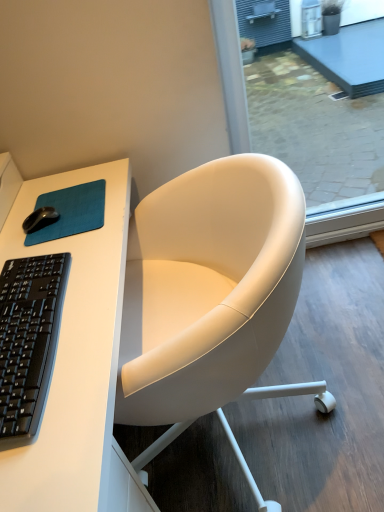
Question: Does transparent glass screen door at upper right contain white leather chair at center?

Choices:
 (A) yes
 (B) no

Answer: (B)

Question: Can we say transparent glass screen door at upper right lies outside white leather chair at center?

Choices:
 (A) no
 (B) yes

Answer: (B)

Question: Does transparent glass screen door at upper right have a lesser height compared to white leather chair at center?

Choices:
 (A) no
 (B) yes

Answer: (A)

Question: Is transparent glass screen door at upper right to the right of white leather chair at center from the viewer's perspective?

Choices:
 (A) yes
 (B) no

Answer: (A)

Question: Are transparent glass screen door at upper right and white leather chair at center located far from each other?

Choices:
 (A) yes
 (B) no

Answer: (B)

Question: From their relative heights in the image, would you say white leather chair at center is taller or shorter than teal fabric mousepad at upper left?

Choices:
 (A) tall
 (B) short

Answer: (A)

Question: From a real-world perspective, relative to teal fabric mousepad at upper left, is white leather chair at center vertically above or below?

Choices:
 (A) above
 (B) below

Answer: (B)

Question: In the image, is white leather chair at center positioned in front of or behind teal fabric mousepad at upper left?

Choices:
 (A) behind
 (B) front

Answer: (A)

Question: From the image's perspective, is white leather chair at center positioned above or below teal fabric mousepad at upper left?

Choices:
 (A) above
 (B) below

Answer: (B)

Question: Considering the positions of transparent glass screen door at upper right and white matte desk at upper left in the image, is transparent glass screen door at upper right taller or shorter than white matte desk at upper left?

Choices:
 (A) short
 (B) tall

Answer: (B)

Question: Would you say transparent glass screen door at upper right is inside or outside white matte desk at upper left?

Choices:
 (A) outside
 (B) inside

Answer: (A)

Question: Is point (236, 54) positioned closer to the camera than point (100, 411)?

Choices:
 (A) farther
 (B) closer

Answer: (A)

Question: Considering the positions of transparent glass screen door at upper right and white matte desk at upper left in the image, is transparent glass screen door at upper right wider or thinner than white matte desk at upper left?

Choices:
 (A) wide
 (B) thin

Answer: (B)

Question: From the image's perspective, is transparent glass screen door at upper right positioned above or below white leather chair at center?

Choices:
 (A) below
 (B) above

Answer: (B)

Question: Considering the positions of transparent glass screen door at upper right and white leather chair at center in the image, is transparent glass screen door at upper right wider or thinner than white leather chair at center?

Choices:
 (A) wide
 (B) thin

Answer: (B)